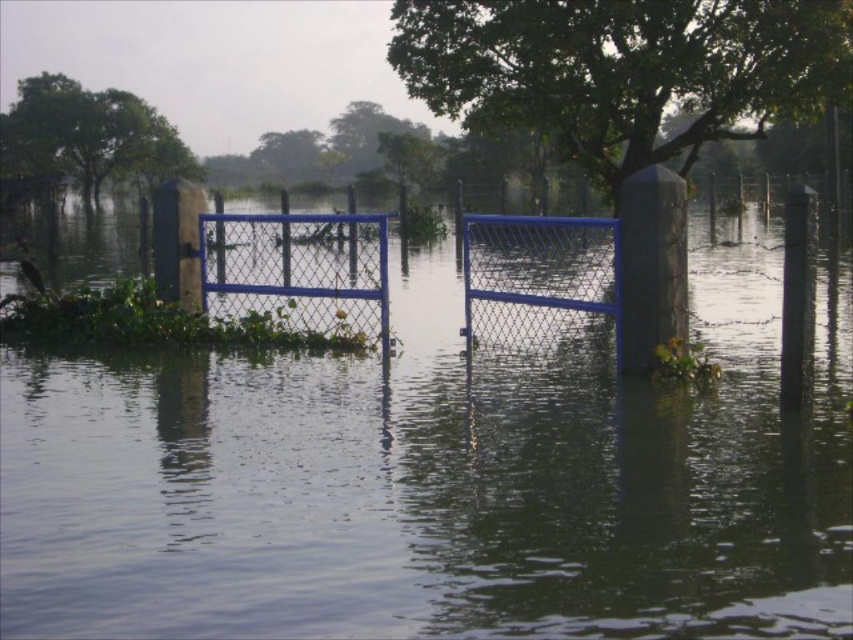
Based on the photo, can you confirm if green leafy tree at center is positioned below green leafy tree at upper left?

Indeed, green leafy tree at center is positioned under green leafy tree at upper left.

Does point (726, 136) come closer to viewer compared to point (141, 120)?

Yes, point (726, 136) is closer to viewer.

Locate an element on the screen. green leafy tree at center is located at coordinates (624, 68).

Who is more forward, (42, 381) or (788, 305)?

Positioned in front is point (788, 305).

How much distance is there between blue metallic gate at center and black plastic pole at right?

5.26 meters

I want to click on blue metallic gate at center, so click(x=436, y=484).

The height and width of the screenshot is (640, 853). I want to click on blue metallic gate at center, so [436, 484].

Does blue chain-link fence at center appear on the right side of black plastic pole at right?

No, blue chain-link fence at center is not to the right of black plastic pole at right.

Does blue chain-link fence at center come in front of black plastic pole at right?

No, blue chain-link fence at center is further to the viewer.

The image size is (853, 640). I want to click on blue chain-link fence at center, so click(x=300, y=262).